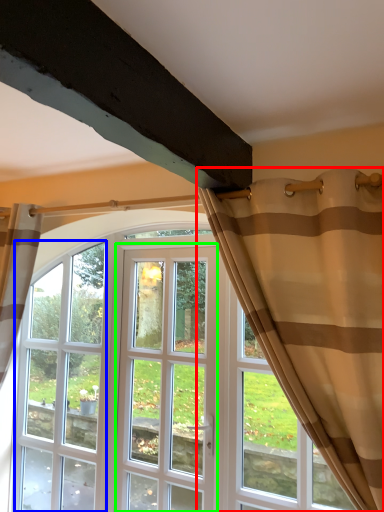
Question: Which object is the farthest from curtain (highlighted by a red box)? Choose among these: window (highlighted by a blue box) or screen door (highlighted by a green box).

Choices:
 (A) window
 (B) screen door

Answer: (A)